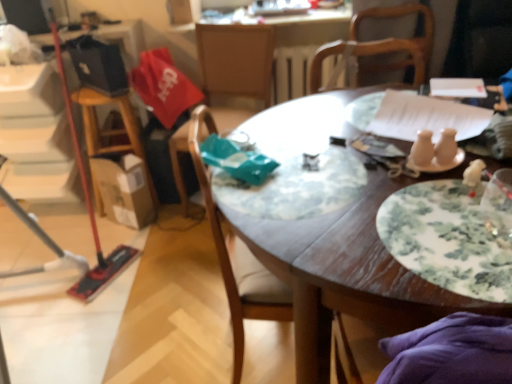
Question: Should I look upward or downward to see wooden table at center?

Choices:
 (A) down
 (B) up

Answer: (A)

Question: Which direction should I rotate to face wooden chair at center, the 2th chair when ordered from back to front, — up or down?

Choices:
 (A) up
 (B) down

Answer: (B)

Question: From the image's perspective, is wooden table at center below wooden chair at center, the second chair positioned from the front?

Choices:
 (A) yes
 (B) no

Answer: (A)

Question: Is wooden table at center to the left of wooden chair at center, the second chair positioned from the front, from the viewer's perspective?

Choices:
 (A) no
 (B) yes

Answer: (A)

Question: Considering the relative sizes of wooden table at center and wooden chair at center, positioned as the first chair in back-to-front order, in the image provided, is wooden table at center bigger than wooden chair at center, positioned as the first chair in back-to-front order,?

Choices:
 (A) yes
 (B) no

Answer: (A)

Question: From a real-world perspective, is wooden table at center under wooden chair at center, the second chair positioned from the front?

Choices:
 (A) no
 (B) yes

Answer: (B)

Question: From a real-world perspective, does wooden table at center stand above wooden chair at center, the second chair positioned from the front?

Choices:
 (A) yes
 (B) no

Answer: (B)

Question: Is wooden table at center taller than wooden chair at center, the second chair positioned from the front?

Choices:
 (A) no
 (B) yes

Answer: (A)

Question: Can floral-patterned ceramic plate at center-right be found inside wooden chair at center, positioned as the first chair in back-to-front order?

Choices:
 (A) yes
 (B) no

Answer: (B)

Question: Could you tell me if wooden chair at center, positioned as the first chair in back-to-front order, is facing floral-patterned ceramic plate at center-right?

Choices:
 (A) no
 (B) yes

Answer: (B)

Question: From a real-world perspective, is wooden chair at center, the second chair positioned from the front, on floral-patterned ceramic plate at center-right?

Choices:
 (A) yes
 (B) no

Answer: (B)

Question: Does wooden chair at center, the second chair positioned from the front, have a smaller size compared to floral-patterned ceramic plate at center-right?

Choices:
 (A) no
 (B) yes

Answer: (A)

Question: Is wooden chair at center, the second chair positioned from the front, shorter than floral-patterned ceramic plate at center-right?

Choices:
 (A) yes
 (B) no

Answer: (B)

Question: From the image's perspective, is wooden chair at center, the second chair positioned from the front, over floral-patterned ceramic plate at center-right?

Choices:
 (A) no
 (B) yes

Answer: (B)

Question: From a real-world perspective, does floral-patterned ceramic plate at center-right sit lower than wooden table at center?

Choices:
 (A) no
 (B) yes

Answer: (A)